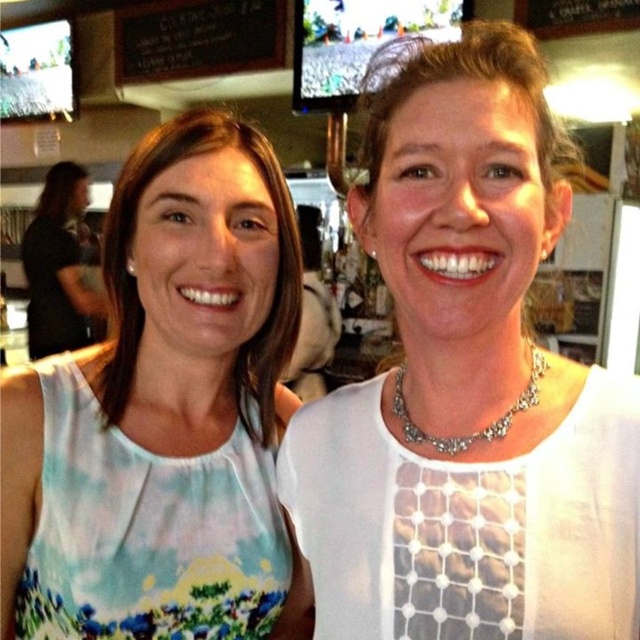
You are a photographer trying to capture a closeup shot of the silver metallic necklace at center. You are currently positioned 5 feet away from the matte black shirt at left. Is the necklace within your reach without moving closer?

The distance between the matte black shirt at left and the silver metallic necklace at center is 10.55 feet. Since you are 5 feet away from the matte black shirt at left, the necklace is still 5.55 feet away from you. Therefore, it is not within reach without moving closer.

You are standing in a room and see the image. You want to locate the matte black shirt at left. Where is it positioned in the image?

The matte black shirt at left is positioned at the coordinates point (58, 268).

You are a painter standing in front of the black chalkboard at upper center and the silver metallic necklace at center. You want to paint a large mural that requires a wide surface. Which object would be more suitable as a canvas?

The black chalkboard at upper center is wider than the silver metallic necklace at center, so it would be more suitable as a canvas for a large mural.